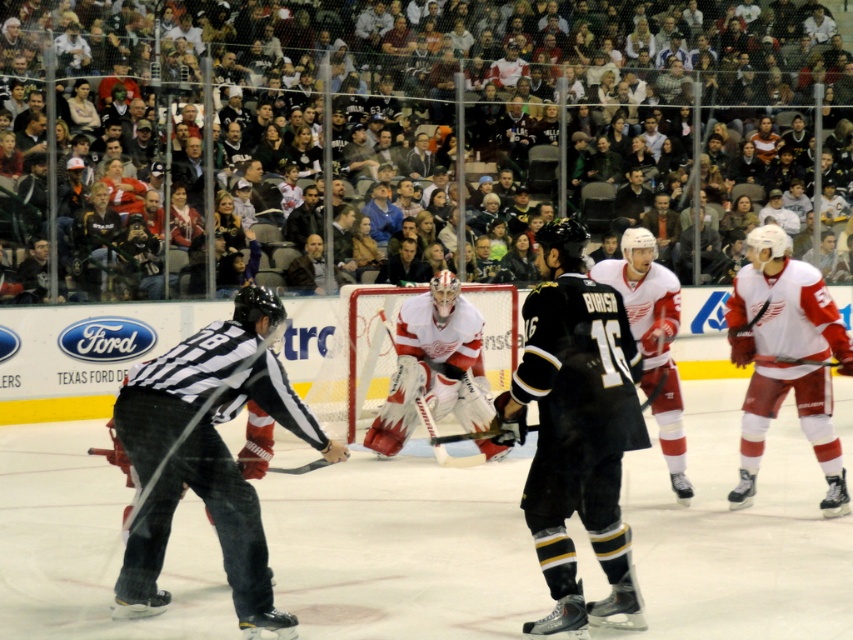
Question: Which object is farther from the camera taking this photo?

Choices:
 (A) red matte jersey at center
 (B) white jersey at right

Answer: (B)

Question: Which point is closer to the camera taking this photo?

Choices:
 (A) (672, 374)
 (B) (445, 284)
 (C) (245, 452)
 (D) (741, 344)

Answer: (C)

Question: Is black jersey at center bigger than white jersey at right?

Choices:
 (A) yes
 (B) no

Answer: (B)

Question: Is white jersey at right thinner than black matte hockey stick at center?

Choices:
 (A) yes
 (B) no

Answer: (B)

Question: Is white jersey at center further to the viewer compared to white jersey at right?

Choices:
 (A) yes
 (B) no

Answer: (B)

Question: Which point appears farthest from the camera in this image?

Choices:
 (A) 114,458
 (B) 161,451

Answer: (A)